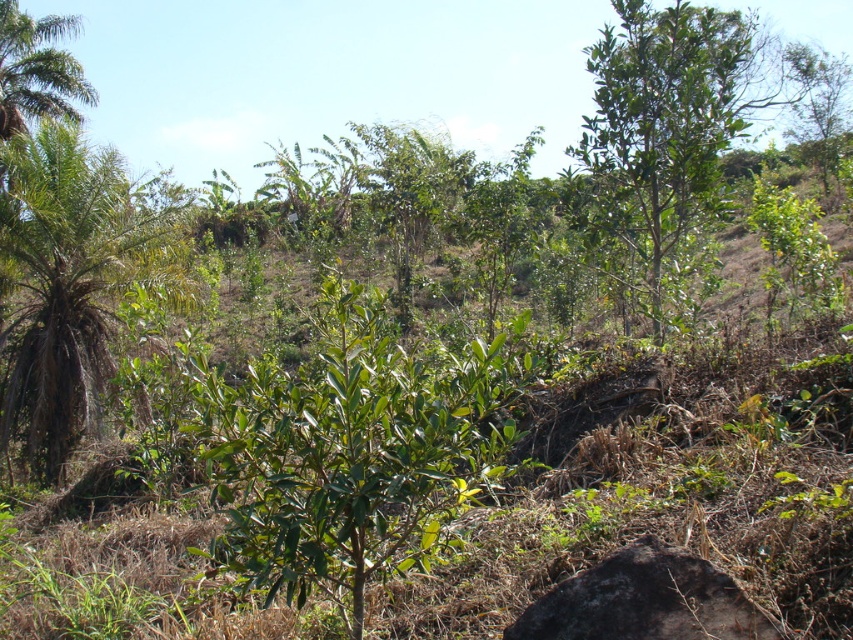
Can you confirm if green leafy tree at upper right is thinner than dark gray rock at lower right?

No.

Which is below, green leafy tree at upper right or dark gray rock at lower right?

dark gray rock at lower right

Is point (643, 96) farther from viewer compared to point (569, 627)?

Yes, point (643, 96) is farther from viewer.

The image size is (853, 640). What are the coordinates of `green leafy tree at upper right` in the screenshot? It's located at (669, 134).

Is green leafy palm tree at left closer to camera compared to dark gray rock at lower right?

No, green leafy palm tree at left is further to the viewer.

Who is positioned more to the left, green leafy palm tree at left or dark gray rock at lower right?

green leafy palm tree at left is more to the left.

Is point (18, 442) in front of point (595, 577)?

No, (18, 442) is behind (595, 577).

Where is `green leafy palm tree at left`? green leafy palm tree at left is located at coordinates (67, 282).

Which is in front, point (728, 24) or point (65, 410)?

Point (65, 410) is in front.

Who is shorter, green leafy tree at upper right or green leafy palm tree at left?

green leafy palm tree at left

Is point (643, 237) positioned behind point (22, 336)?

No, it is not.

Locate an element on the screen. The height and width of the screenshot is (640, 853). green leafy tree at upper right is located at coordinates [x=669, y=134].